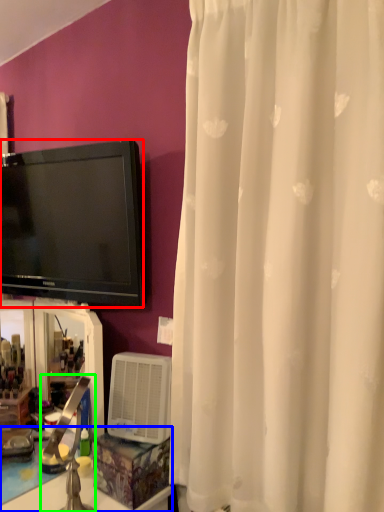
Question: Based on their relative distances, which object is nearer to television (highlighted by a red box)? Choose from counter top (highlighted by a blue box) and faucet (highlighted by a green box).

Choices:
 (A) counter top
 (B) faucet

Answer: (B)